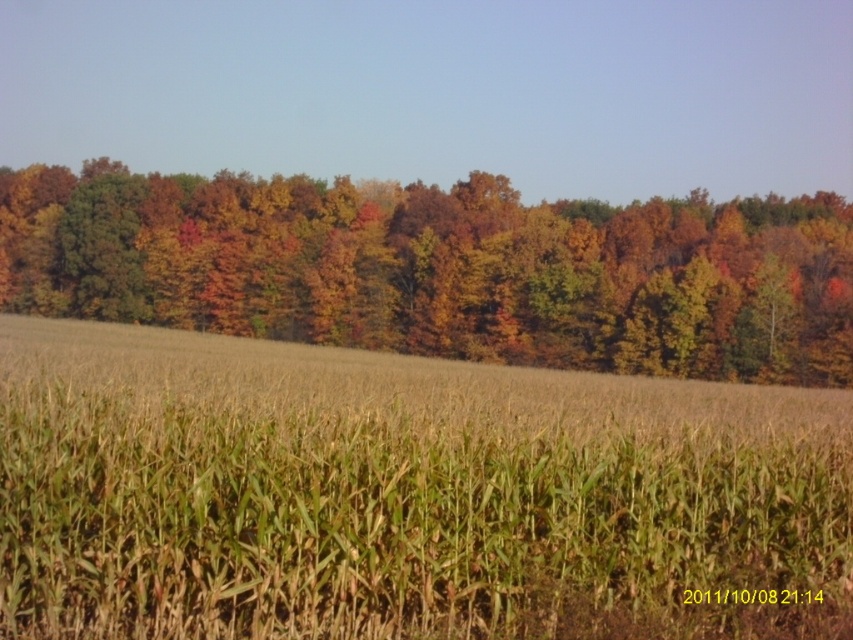
Question: Does green matte wheat field at center appear on the left side of autumn leaves at center?

Choices:
 (A) no
 (B) yes

Answer: (A)

Question: Which point is closer to the camera taking this photo?

Choices:
 (A) (426, 595)
 (B) (838, 291)

Answer: (A)

Question: Among these points, which one is farthest from the camera?

Choices:
 (A) (177, 454)
 (B) (67, 176)

Answer: (B)

Question: Can you confirm if green matte wheat field at center is smaller than autumn leaves at center?

Choices:
 (A) yes
 (B) no

Answer: (A)

Question: Does green matte wheat field at center have a larger size compared to autumn leaves at center?

Choices:
 (A) yes
 (B) no

Answer: (B)